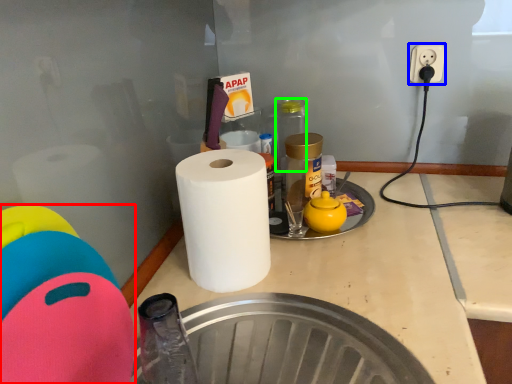
Question: Which object is positioned closest to toy (highlighted by a red box)? Select from electric outlet (highlighted by a blue box) and bottle (highlighted by a green box).

Choices:
 (A) electric outlet
 (B) bottle

Answer: (B)